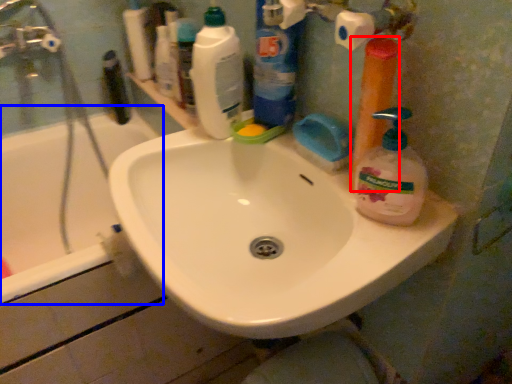
Question: Which point is further to the camera, cleaning product (highlighted by a red box) or bathtub (highlighted by a blue box)?

Choices:
 (A) cleaning product
 (B) bathtub

Answer: (B)